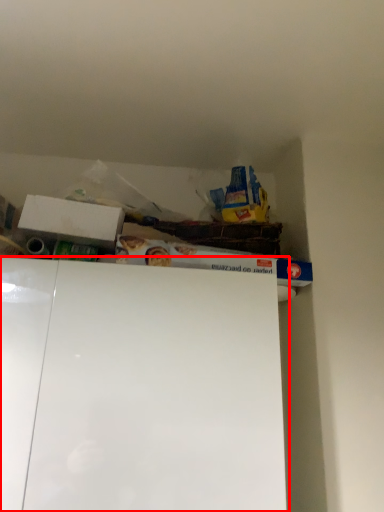
Question: From the image's perspective, where is cabinet (annotated by the red box) located in relation to box in the image?

Choices:
 (A) above
 (B) below

Answer: (B)